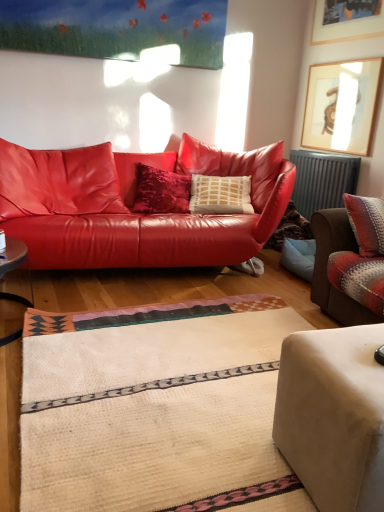
Question: Should I look upward or downward to see metallic gray radiator at right?

Choices:
 (A) down
 (B) up

Answer: (B)

Question: Are wooden framed artwork at upper right, the first picture frame when ordered from bottom to top, and matte leather couch at center, acting as the 3th studio couch starting from the front, making contact?

Choices:
 (A) no
 (B) yes

Answer: (A)

Question: Considering the relative sizes of wooden framed artwork at upper right, the first picture frame when ordered from bottom to top, and matte leather couch at center, acting as the 3th studio couch starting from the front, in the image provided, is wooden framed artwork at upper right, the first picture frame when ordered from bottom to top, bigger than matte leather couch at center, acting as the 3th studio couch starting from the front,?

Choices:
 (A) yes
 (B) no

Answer: (B)

Question: Is wooden framed artwork at upper right, the first picture frame when ordered from bottom to top, facing away from matte leather couch at center, acting as the 3th studio couch starting from the front?

Choices:
 (A) yes
 (B) no

Answer: (B)

Question: Is wooden framed artwork at upper right, which is counted as the second picture frame, starting from the top, thinner than matte leather couch at center, acting as the 3th studio couch starting from the front?

Choices:
 (A) no
 (B) yes

Answer: (B)

Question: From the image's perspective, is wooden framed artwork at upper right, which is counted as the second picture frame, starting from the top, on matte leather couch at center, acting as the 3th studio couch starting from the front?

Choices:
 (A) yes
 (B) no

Answer: (A)

Question: From the image's perspective, does wooden framed artwork at upper right, the first picture frame when ordered from bottom to top, appear lower than matte leather couch at center, acting as the 3th studio couch starting from the front?

Choices:
 (A) yes
 (B) no

Answer: (B)

Question: Does wooden framed artwork at upper right, the first picture frame when ordered from bottom to top, appear on the right side of wooden picture frame at upper right, the 1th picture frame from the top?

Choices:
 (A) no
 (B) yes

Answer: (A)

Question: Is wooden framed artwork at upper right, which is counted as the second picture frame, starting from the top, smaller than wooden picture frame at upper right, positioned as the second picture frame in bottom-to-top order?

Choices:
 (A) yes
 (B) no

Answer: (B)

Question: Can you confirm if wooden framed artwork at upper right, the first picture frame when ordered from bottom to top, is taller than wooden picture frame at upper right, the 1th picture frame from the top?

Choices:
 (A) yes
 (B) no

Answer: (A)

Question: From a real-world perspective, is wooden framed artwork at upper right, which is counted as the second picture frame, starting from the top, physically below wooden picture frame at upper right, positioned as the second picture frame in bottom-to-top order?

Choices:
 (A) yes
 (B) no

Answer: (A)

Question: Considering the relative sizes of wooden framed artwork at upper right, the first picture frame when ordered from bottom to top, and wooden picture frame at upper right, positioned as the second picture frame in bottom-to-top order, in the image provided, is wooden framed artwork at upper right, the first picture frame when ordered from bottom to top, wider than wooden picture frame at upper right, positioned as the second picture frame in bottom-to-top order,?

Choices:
 (A) yes
 (B) no

Answer: (B)

Question: From a real-world perspective, is wooden framed artwork at upper right, which is counted as the second picture frame, starting from the top, located higher than wooden picture frame at upper right, positioned as the second picture frame in bottom-to-top order?

Choices:
 (A) no
 (B) yes

Answer: (A)

Question: Is matte leather couch at center, which ranks as the first studio couch in back-to-front order, behind beige fabric ottoman at lower right, acting as the 3th studio couch starting from the back?

Choices:
 (A) yes
 (B) no

Answer: (A)